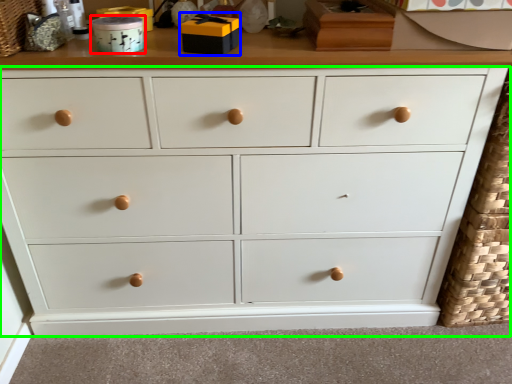
Question: Based on their relative distances, which object is nearer to toy (highlighted by a red box)? Choose from toy (highlighted by a blue box) and chest of drawers (highlighted by a green box).

Choices:
 (A) toy
 (B) chest of drawers

Answer: (A)